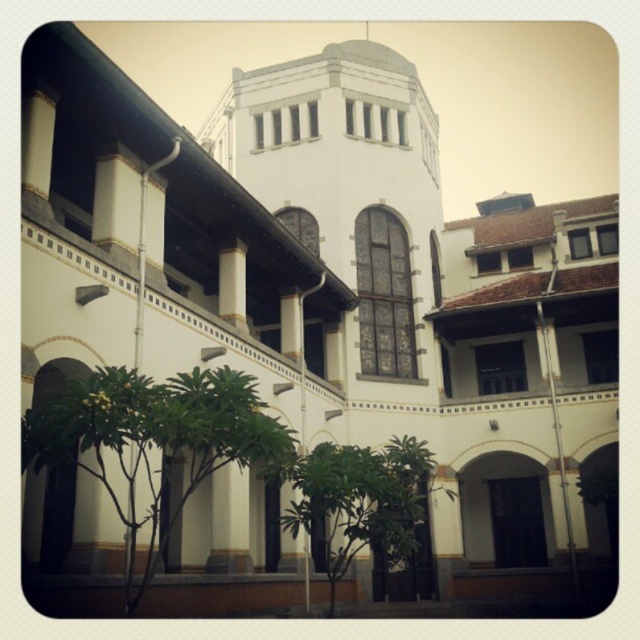
Question: Which point is closer to the camera taking this photo?

Choices:
 (A) (186, 433)
 (B) (372, 534)

Answer: (A)

Question: Is green leafy tree at lower left in front of green leafy tree at center?

Choices:
 (A) yes
 (B) no

Answer: (A)

Question: Is green leafy tree at lower left thinner than green leafy tree at center?

Choices:
 (A) yes
 (B) no

Answer: (A)

Question: Which object is closer to the camera taking this photo?

Choices:
 (A) green leafy tree at lower left
 (B) green leafy tree at center

Answer: (A)

Question: Is green leafy tree at lower left to the right of green leafy tree at center from the viewer's perspective?

Choices:
 (A) yes
 (B) no

Answer: (B)